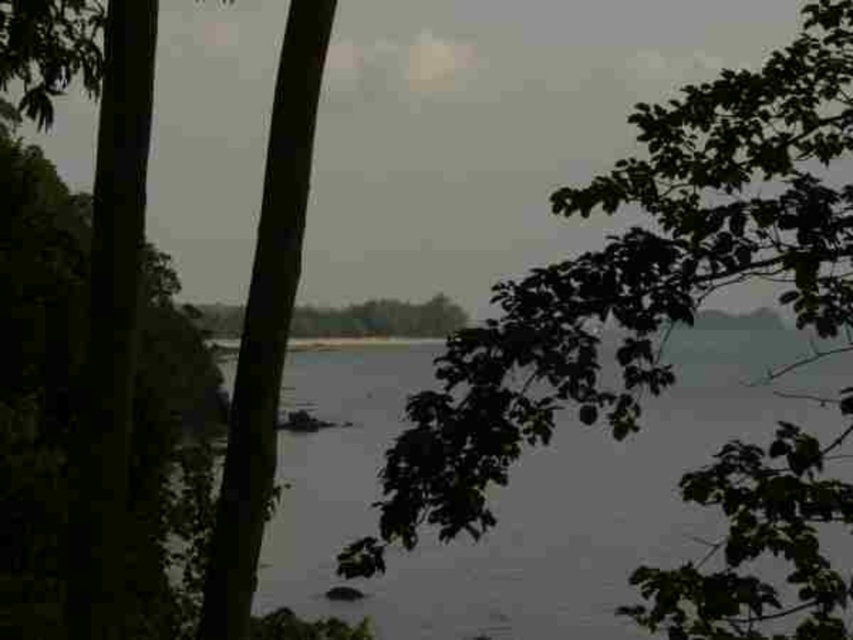
Question: Is green leafy tree at upper right below clear water at center?

Choices:
 (A) yes
 (B) no

Answer: (B)

Question: Which object appears closest to the camera in this image?

Choices:
 (A) clear water at center
 (B) green leafy tree at upper right

Answer: (B)

Question: Which point is closer to the camera?

Choices:
 (A) green leafy tree at upper right
 (B) clear water at center

Answer: (A)

Question: Is green leafy tree at upper right further to the viewer compared to clear water at center?

Choices:
 (A) no
 (B) yes

Answer: (A)

Question: Among these points, which one is nearest to the camera?

Choices:
 (A) (283, 474)
 (B) (724, 470)

Answer: (B)

Question: From the image, what is the correct spatial relationship of green leafy tree at upper right in relation to clear water at center?

Choices:
 (A) above
 (B) below

Answer: (A)